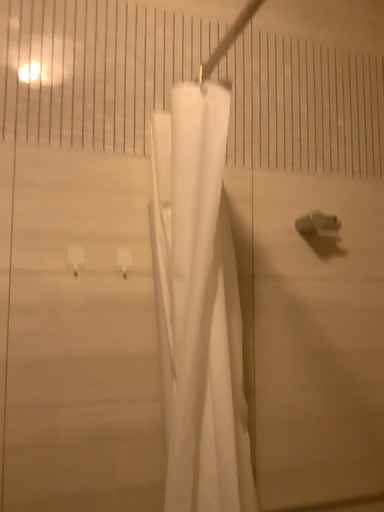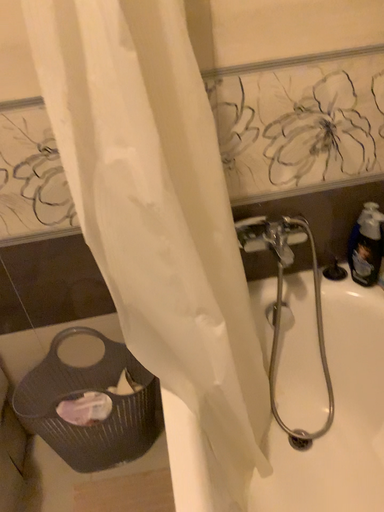
Question: Which way did the camera rotate in the video?

Choices:
 (A) rotated left
 (B) rotated right

Answer: (A)